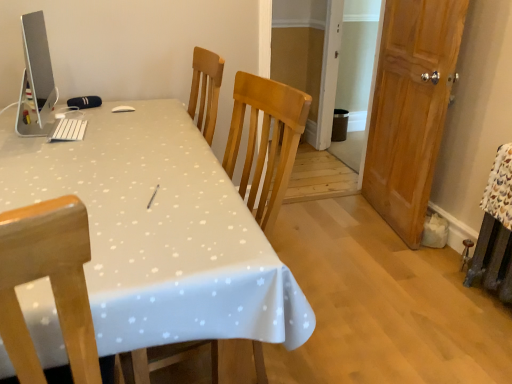
The height and width of the screenshot is (384, 512). I want to click on sleek silver monitor at upper left, so point(39,86).

What is the approximate width of wooden door at right?

wooden door at right is 9.00 inches wide.

The height and width of the screenshot is (384, 512). Describe the element at coordinates (410, 109) in the screenshot. I see `wooden door at right` at that location.

This screenshot has height=384, width=512. In order to click on white glossy table at center in this screenshot , I will do `click(160, 232)`.

Considering the sizes of objects white glossy table at center and sleek silver monitor at upper left in the image provided, who is bigger, white glossy table at center or sleek silver monitor at upper left?

white glossy table at center is bigger.

From the image's perspective, which one is positioned lower, white glossy table at center or sleek silver monitor at upper left?

white glossy table at center.

In the scene shown: From a real-world perspective, is white glossy table at center physically located above or below sleek silver monitor at upper left?

white glossy table at center is below sleek silver monitor at upper left.

Could you tell me if white glossy table at center is turned towards sleek silver monitor at upper left?

No, white glossy table at center is not oriented towards sleek silver monitor at upper left.

Between point (455, 42) and point (262, 276), which one is positioned behind?

Point (455, 42)

In the scene shown: Considering the positions of objects wooden door at right and white glossy table at center in the image provided, who is behind, wooden door at right or white glossy table at center?

wooden door at right is behind.

How far apart are wooden door at right and white glossy table at center?

wooden door at right and white glossy table at center are 4.88 feet apart from each other.

Is point (367, 170) farther from camera compared to point (57, 96)?

Yes, point (367, 170) is farther from viewer.

Who is more distant, wooden door at right or sleek silver monitor at upper left?

wooden door at right is further away from the camera.

Is wooden door at right aimed at sleek silver monitor at upper left?

Yes, wooden door at right is aimed at sleek silver monitor at upper left.

You are a GUI agent. You are given a task and a screenshot of the screen. Output one action in this format:
    pyautogui.click(x=<x>, y=<y>)
    Task: Click on the desktop computer above the white glossy table at center (from a real-world perspective)
    
    Given the screenshot: What is the action you would take?
    pyautogui.click(x=39, y=86)

Considering the relative positions of sleek silver monitor at upper left and white glossy table at center in the image provided, is sleek silver monitor at upper left to the left or to the right of white glossy table at center?

Based on their positions, sleek silver monitor at upper left is located to the left of white glossy table at center.

Is sleek silver monitor at upper left in contact with white glossy table at center?

No, sleek silver monitor at upper left is not touching white glossy table at center.

Does white glossy table at center appear on the left side of wooden door at right?

Yes.

Considering the sizes of objects white glossy table at center and wooden door at right in the image provided, who is thinner, white glossy table at center or wooden door at right?

wooden door at right is thinner.

What's the angular difference between white glossy table at center and wooden door at right's facing directions?

The facing directions of white glossy table at center and wooden door at right are 99.7 degrees apart.

Is point (158, 137) closer or farther from the camera than point (411, 207)?

Clearly, point (158, 137) is closer to the camera than point (411, 207).

Is sleek silver monitor at upper left closer to camera compared to wooden door at right?

Yes, it is in front of wooden door at right.

From a real-world perspective, between sleek silver monitor at upper left and wooden door at right, who is vertically higher?

From a 3D spatial view, sleek silver monitor at upper left is above.

Is wooden door at right at the back of sleek silver monitor at upper left?

No, sleek silver monitor at upper left is not facing the opposite direction of wooden door at right.

Is the surface of sleek silver monitor at upper left in direct contact with wooden door at right?

No, sleek silver monitor at upper left is not beside wooden door at right.

Locate an element on the screen. desk that is on the right side of sleek silver monitor at upper left is located at coordinates (160, 232).

Locate an element on the screen. The height and width of the screenshot is (384, 512). door that appears above the white glossy table at center (from the image's perspective) is located at coordinates (410, 109).

Estimate the real-world distances between objects in this image. Which object is closer to sleek silver monitor at upper left, white glossy table at center or wooden door at right?

white glossy table at center.

Which object lies further to the anchor point sleek silver monitor at upper left, wooden door at right or white glossy table at center?

Among the two, wooden door at right is located further to sleek silver monitor at upper left.

In the scene shown: Considering their positions, is sleek silver monitor at upper left positioned closer to wooden door at right than white glossy table at center?

The object closer to wooden door at right is white glossy table at center.

When comparing their distances from white glossy table at center, does wooden door at right or sleek silver monitor at upper left seem further?

The object further to white glossy table at center is wooden door at right.

Looking at the image, which one is located closer to white glossy table at center, sleek silver monitor at upper left or wooden door at right?

sleek silver monitor at upper left.

When comparing their distances from wooden door at right, does white glossy table at center or sleek silver monitor at upper left seem further?

The object further to wooden door at right is sleek silver monitor at upper left.

The image size is (512, 384). Identify the location of desk located between sleek silver monitor at upper left and wooden door at right in the left-right direction. (160, 232).